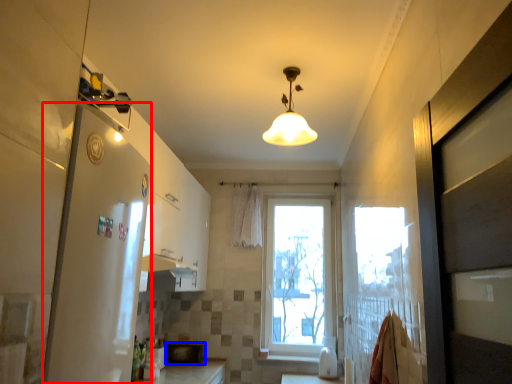
Question: Which point is closer to the camera, screen door (highlighted by a red box) or appliance (highlighted by a blue box)?

Choices:
 (A) screen door
 (B) appliance

Answer: (A)